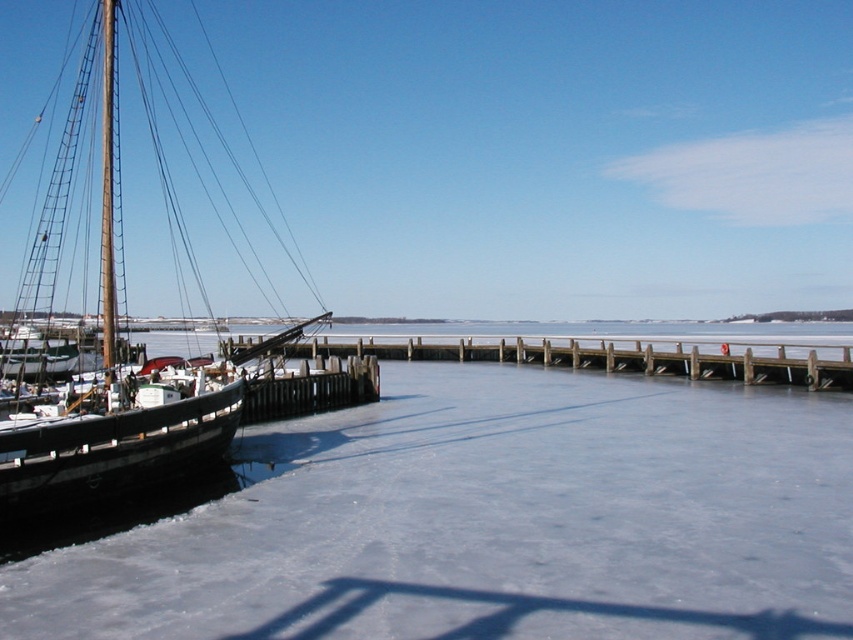
Is wooden sailboat at left shorter than white matte sailboat at left?

Incorrect, wooden sailboat at left's height does not fall short of white matte sailboat at left's.

Who is higher up, wooden sailboat at left or white matte sailboat at left?

Positioned higher is wooden sailboat at left.

This screenshot has height=640, width=853. Identify the location of wooden sailboat at left. (120, 394).

Identify the location of wooden sailboat at left. The height and width of the screenshot is (640, 853). (120, 394).

Measure the distance from white matte snow at center to wooden sailboat at left.

white matte snow at center and wooden sailboat at left are 11.73 meters apart from each other.

Can you confirm if white matte snow at center is positioned to the right of wooden sailboat at left?

Indeed, white matte snow at center is positioned on the right side of wooden sailboat at left.

Locate an element on the screen. The height and width of the screenshot is (640, 853). white matte snow at center is located at coordinates (489, 520).

Does wooden at left come behind wooden mast at left?

Yes, wooden at left is further from the viewer.

Can you confirm if wooden at left is bigger than wooden mast at left?

Correct, wooden at left is larger in size than wooden mast at left.

Which is in front, point (566, 365) or point (108, 81)?

Positioned in front is point (108, 81).

Where is `wooden at left`? wooden at left is located at coordinates (611, 355).